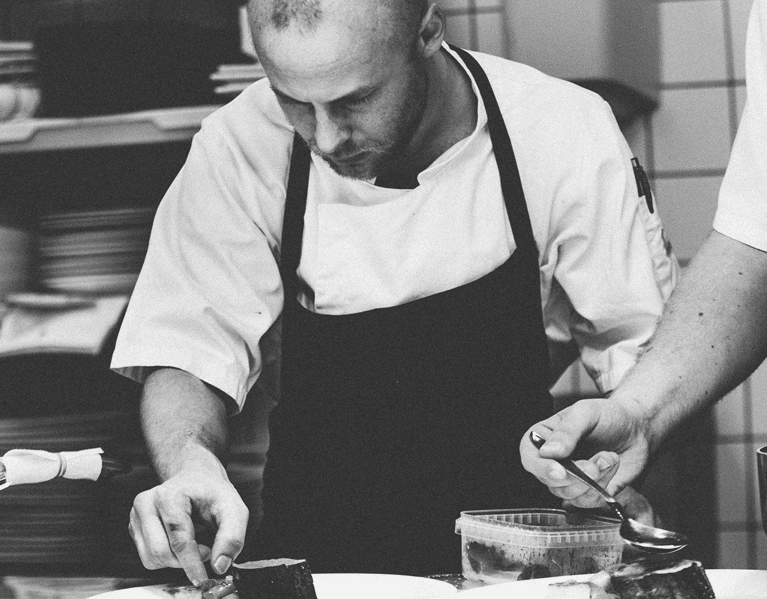
The height and width of the screenshot is (599, 767). In order to click on spoon in this screenshot , I will do `click(657, 540)`.